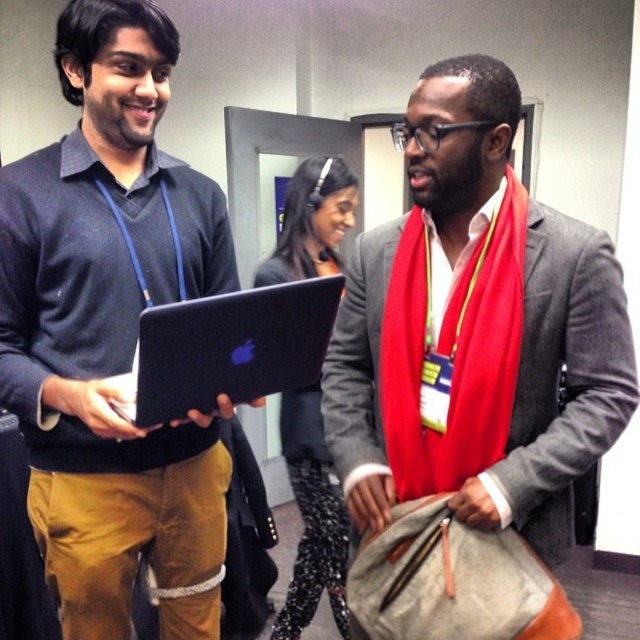
In the scene shown: You are an event organizer arranging a photo shoot in the conference room. You need to position a camera to capture both the matte gray blazer at center and the black glossy laptop at center clearly. Based on their positions, which object should be placed closer to the left side of the camera frame?

The black glossy laptop at center should be placed closer to the left side of the camera frame because the matte gray blazer at center is to the right of it.

You are organizing a tech conference and need to set up a registration desk. The registration desk has a limited space where you can place either the matte black laptop at center or the matte gray blazer at center. Based on their positions in the image, which item should you prioritize placing on the desk first?

The matte black laptop at center should be prioritized because it is positioned below the matte gray blazer at center, meaning it is closer to the desk surface and easier to access.

You are a photographer setting up for a group photo in the conference room. You need to position the matte black laptop at center and the matte gray blazer at center so that both are clearly visible in the frame. Which object should you place closer to the camera to ensure it appears larger in the photo?

The matte black laptop at center is already further to the viewer than the matte gray blazer at center. To make it appear larger in the photo, you should place it closer to the camera since objects closer to the camera appear larger.